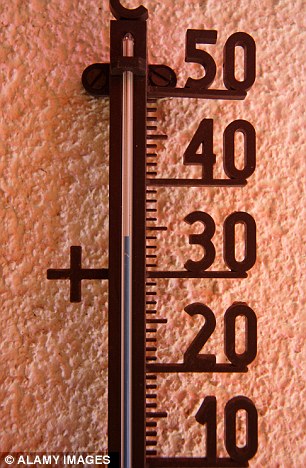
Find the location of a particular element. The image size is (306, 468). bracket is located at coordinates (106, 87).